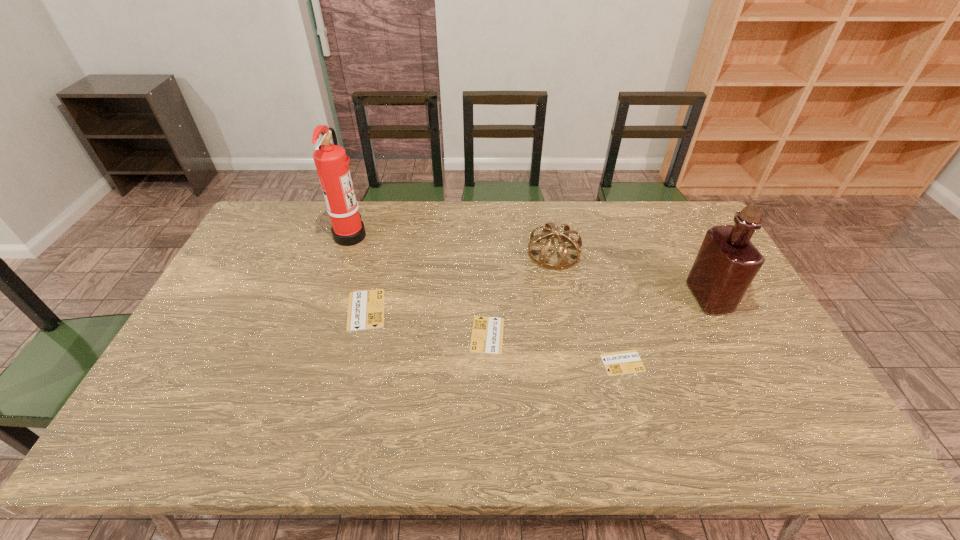
Observe the arrangement of all identity cards in the image. To keep them evenly spaced, where would you place another identity card on the right? Please locate a free space. Please provide its 2D coordinates. Your answer should be formatted as a tuple, i.e. [(x, y)], where the tuple contains the x and y coordinates of a point satisfying the conditions above.

[(775, 394)]